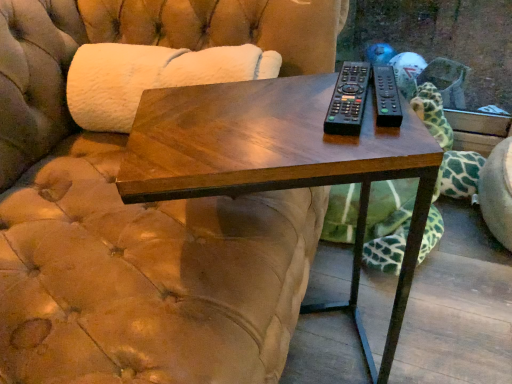
Locate an element on the screen. The height and width of the screenshot is (384, 512). free spot above dark wood table at center (from a real-world perspective) is located at coordinates (280, 114).